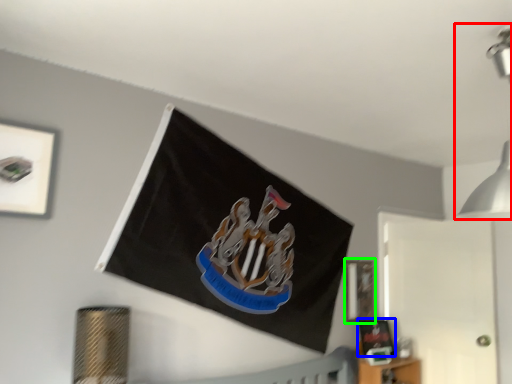
Question: Based on their relative distances, which object is farther from light fixture (highlighted by a red box)? Choose from picture frame (highlighted by a blue box) and picture frame (highlighted by a green box).

Choices:
 (A) picture frame
 (B) picture frame

Answer: (A)